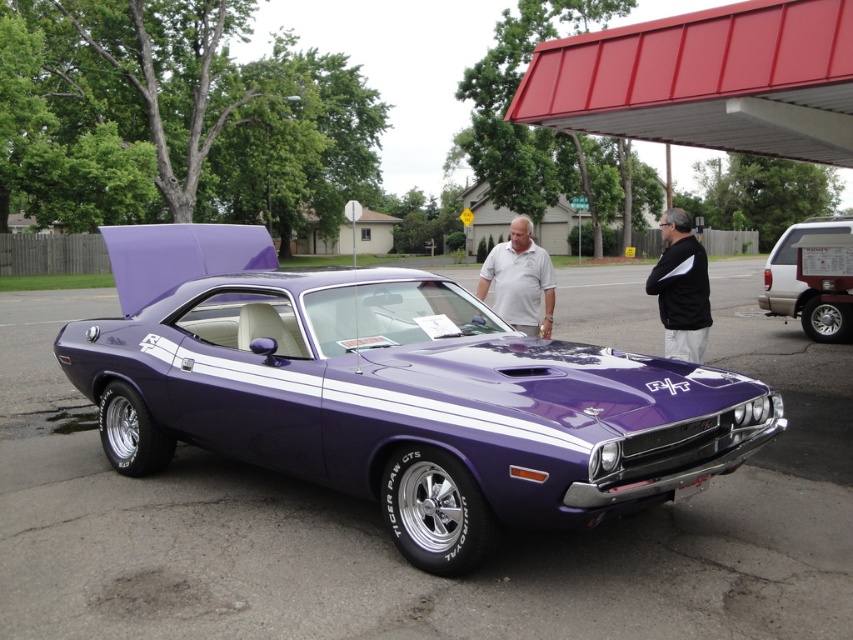
You are standing at the point marked by coordinates (393, 392) in the gas station lot. What object is located exactly at this point?

The purple glossy muscle car at center is located exactly at the point marked by coordinates (393, 392).

You are a photographer positioned at the front of the car. You want to take a photo that includes both the black fabric shirt at center and the white smooth shirt at center. Given that your camera has a maximum focus range of 8 feet, will you be able to capture both subjects in focus without moving your position?

The distance between the black fabric shirt at center and the white smooth shirt at center is 8.93 feet, which exceeds the camera maximum focus range of 8 feet. Therefore, you will not be able to capture both subjects in focus without moving your position.

You are a photographer taking a photo of the black fabric shirt at center and the white smooth shirt at center. Which shirt will appear larger in the photo?

The black fabric shirt at center will appear larger in the photo because it is closer to the viewer than the white smooth shirt at center.